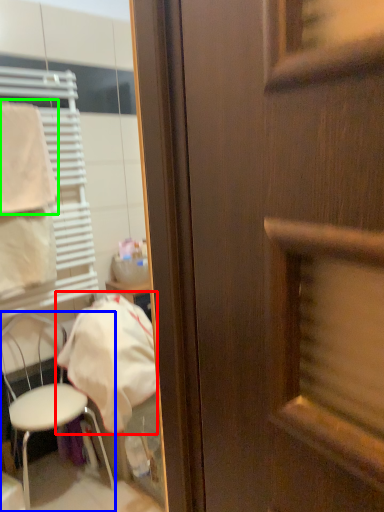
Question: Considering the real-world distances, which object is closest to cloth (highlighted by a red box)? chair (highlighted by a blue box) or towel/napkin (highlighted by a green box).

Choices:
 (A) chair
 (B) towel/napkin

Answer: (A)